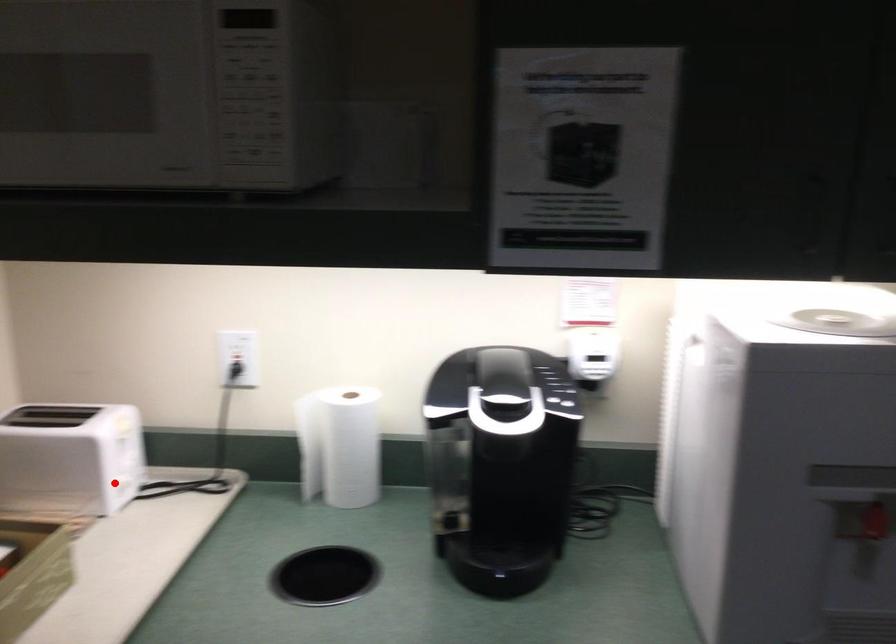
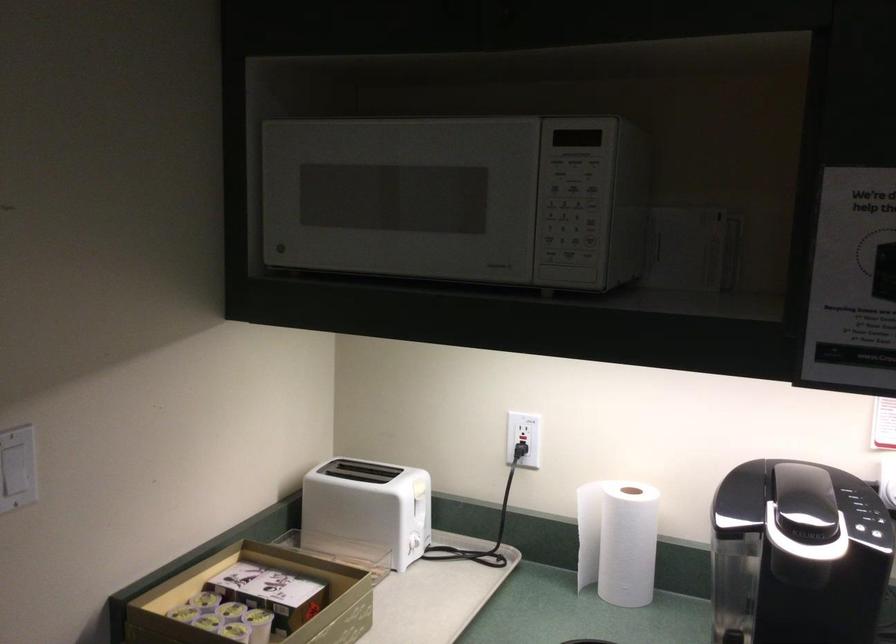
Question: I am providing you with two images of the same scene from different viewpoints. In image1, a red point is highlighted. Considering the same 3D point in image2, which of the following is correct?

Choices:
 (A) It is closer
 (B) It is farther

Answer: (B)